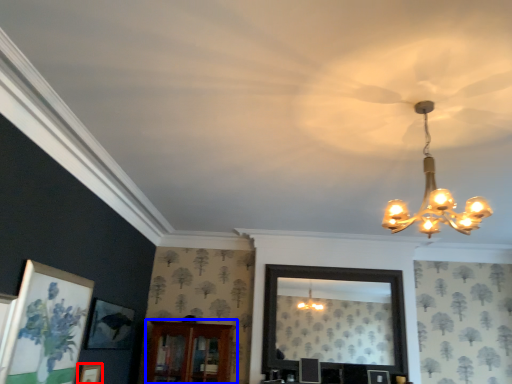
Question: Which point is closer to the camera, picture frame (highlighted by a red box) or furniture (highlighted by a blue box)?

Choices:
 (A) picture frame
 (B) furniture

Answer: (A)